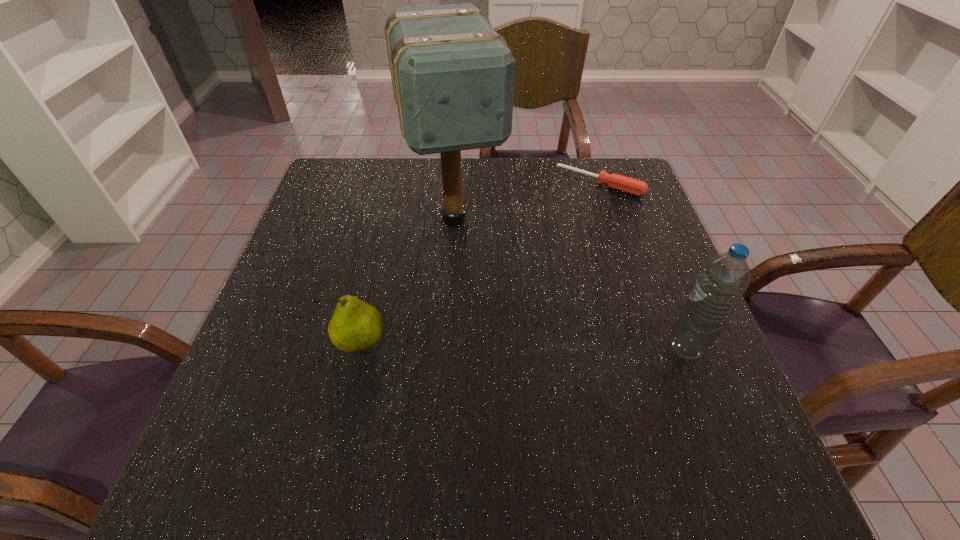
At what (x,y) coordinates should I click in order to perform the action: click on free spot on the desktop that is between the third tallest object and the water bottle and is positioned on the striking surface of the mallet. Please return your answer as a coordinate pair (x, y). The width and height of the screenshot is (960, 540). Looking at the image, I should click on (492, 346).

Where is `vacant space on the desktop that is between the pear and the water bottle and is positioned at the blade of the screwdriver`? This screenshot has height=540, width=960. vacant space on the desktop that is between the pear and the water bottle and is positioned at the blade of the screwdriver is located at coordinates (488, 346).